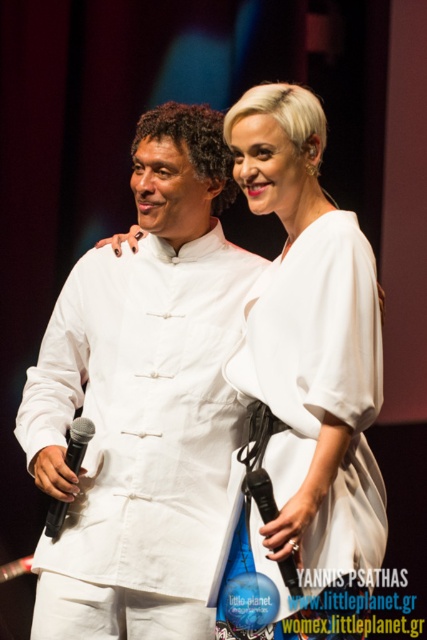
You are a photographer positioned at the back of the stage. You need to capture a photo of both the white matte shirt at center and the white matte dress at center in the same frame. Your camera has a minimum focus distance of 12 inches. Will you be able to focus on both subjects clearly?

The distance between the white matte shirt at center and the white matte dress at center is 13.22 inches, which is greater than the camera minimum focus distance of 12 inches. Therefore, the camera can focus on both subjects clearly.

You are a stagehand who needs to adjust the microphones so that the shorter one is placed on the left side of the stage. Currently, the black matte microphone at left and the black plastic microphone at center are positioned as described. Which microphone should you move to the left side to comply with the requirement?

The black plastic microphone at center should be moved to the left side since it is shorter than the black matte microphone at left, which is taller.

Consider the image. You are a photographer at a stage event and need to adjust the lighting between the white matte shirt at center and the white matte dress at center. Which one is more to the left?

The white matte shirt at center is positioned on the left side of the white matte dress at center, so it is more to the left.